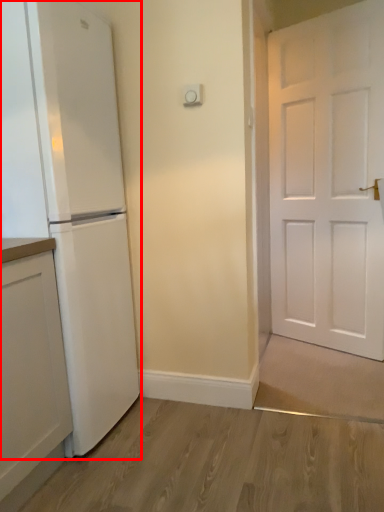
Question: Considering the relative positions of refrigerator (annotated by the red box) and cabinetry in the image provided, where is refrigerator (annotated by the red box) located with respect to the staircase?

Choices:
 (A) right
 (B) left

Answer: (A)